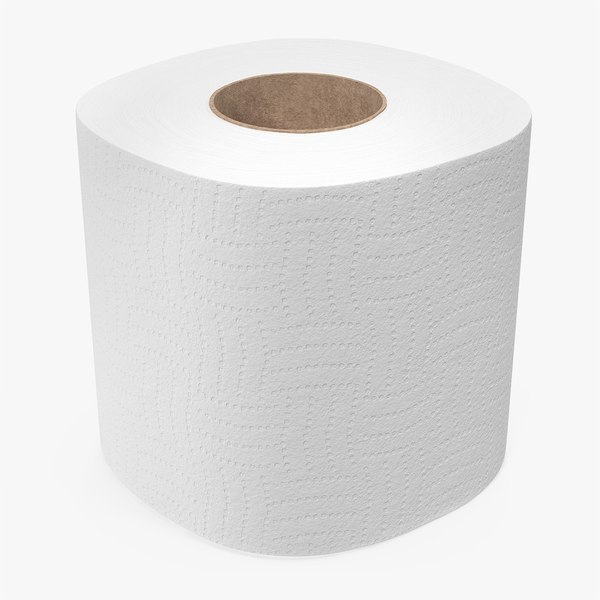
Where is `right top of toilet paper roll`? The height and width of the screenshot is (600, 600). right top of toilet paper roll is located at coordinates (445, 101).